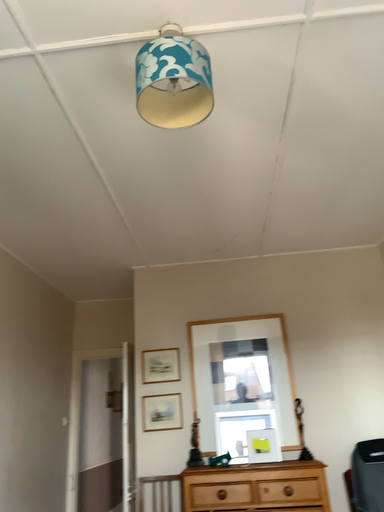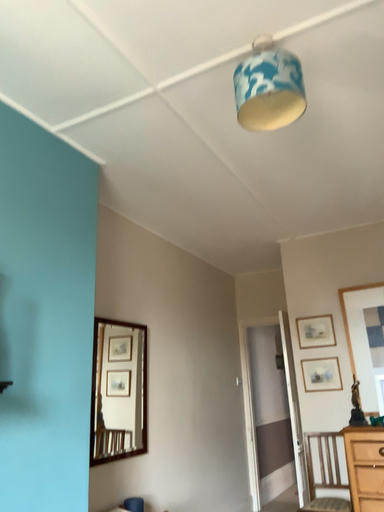
Question: How did the camera likely rotate when shooting the video?

Choices:
 (A) rotated downward
 (B) rotated upward

Answer: (A)